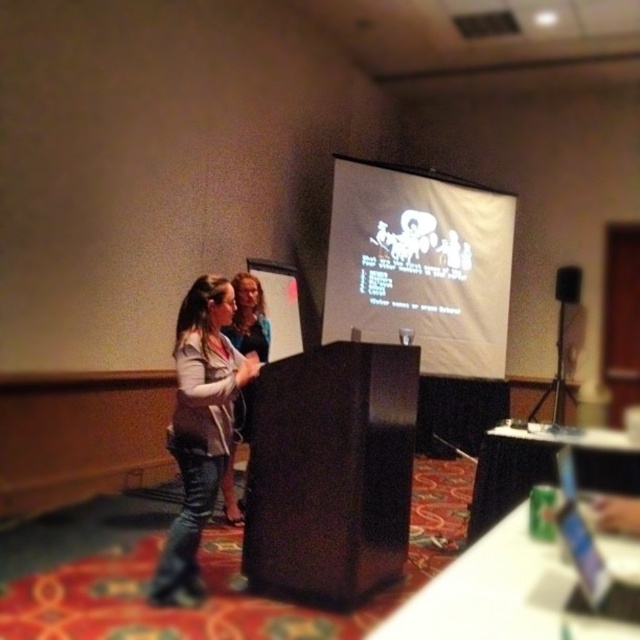
You are organizing a presentation and need to place a laptop that outputs to the white matte projection screen at center and the black matte speaker at upper right. Based on their positions, which object should you place the laptop closer to for optimal viewing and sound quality?

The white matte projection screen at center should be placed closer to the laptop since it is positioned to the left of the black matte speaker at upper right, allowing for better cable management and alignment for both viewing and sound output.

You are setting up a video conference call and need to ensure the camera can capture both the speaker at the podium and the white matte projection screen at center clearly. Given that the camera has a standard 50mm lens, which has a field of view of about 27 degrees, can the camera positioned 19.20 feet away from the screen capture both the speaker and the screen without needing to adjust its position or zoom?

The camera is 19.20 feet away from the white matte projection screen at center. With a 50mm lens providing a 27 degree field of view, the horizontal coverage at that distance would be approximately 8.5 feet. Since the speaker is positioned at the podium in front of the screen, they would fall within this coverage area. Therefore, the camera can capture both the speaker and the screen without adjustment.

You are an attendee at the conference and want to take a photo of the black matte speaker at upper right without including the denim jacket at left in the frame. Is this possible given their positions?

Result: The denim jacket at left is to the left of the black matte speaker at upper right, so if you position yourself to the right side of the denim jacket at left, you can capture the black matte speaker at upper right without including the denim jacket at left in the frame.